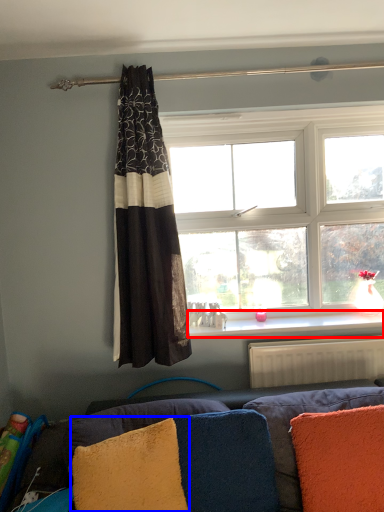
Question: Which object appears closest to the camera in this image, window sill (highlighted by a red box) or pillow (highlighted by a blue box)?

Choices:
 (A) window sill
 (B) pillow

Answer: (B)